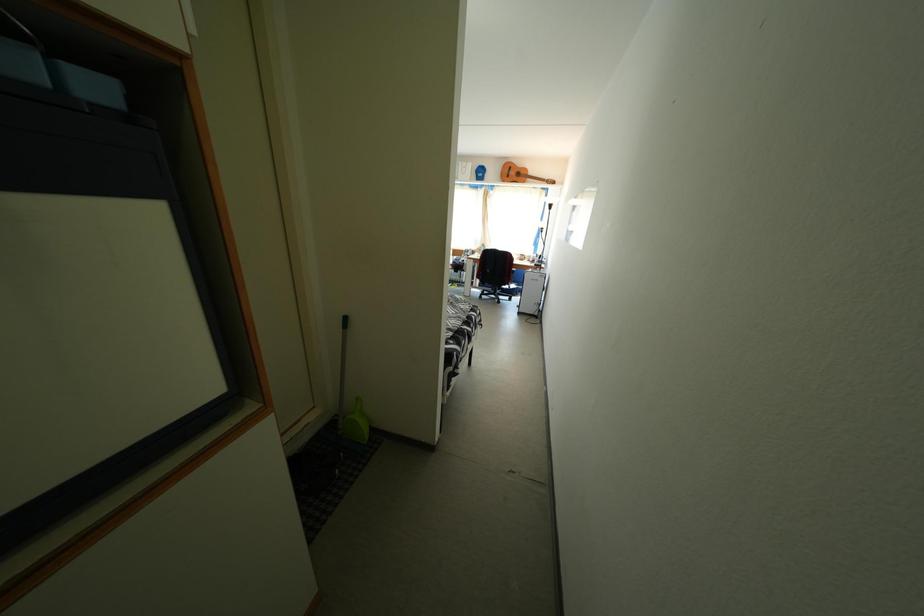
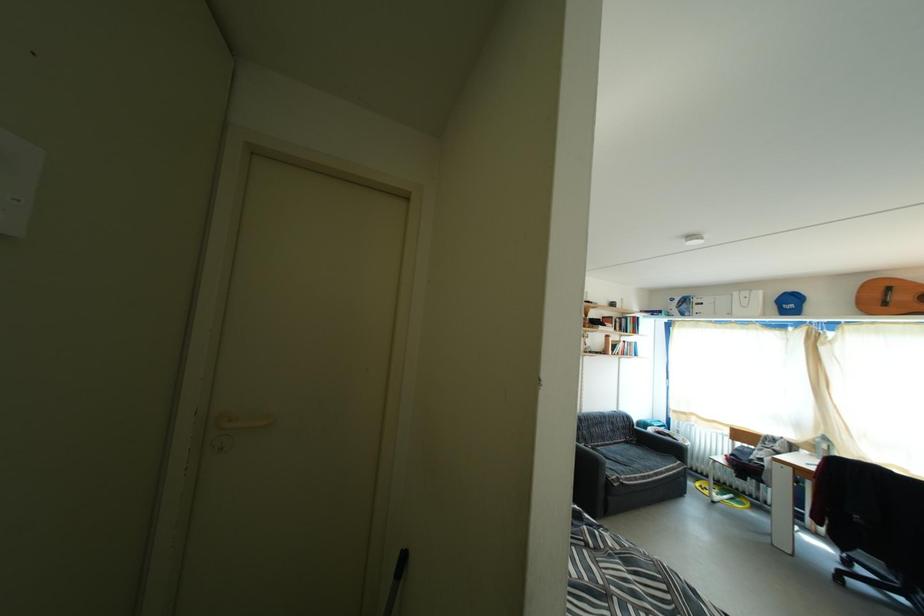
The images are taken continuously from a first-person perspective. In which direction is your viewpoint rotating?

The rotation direction of the camera is left-up.